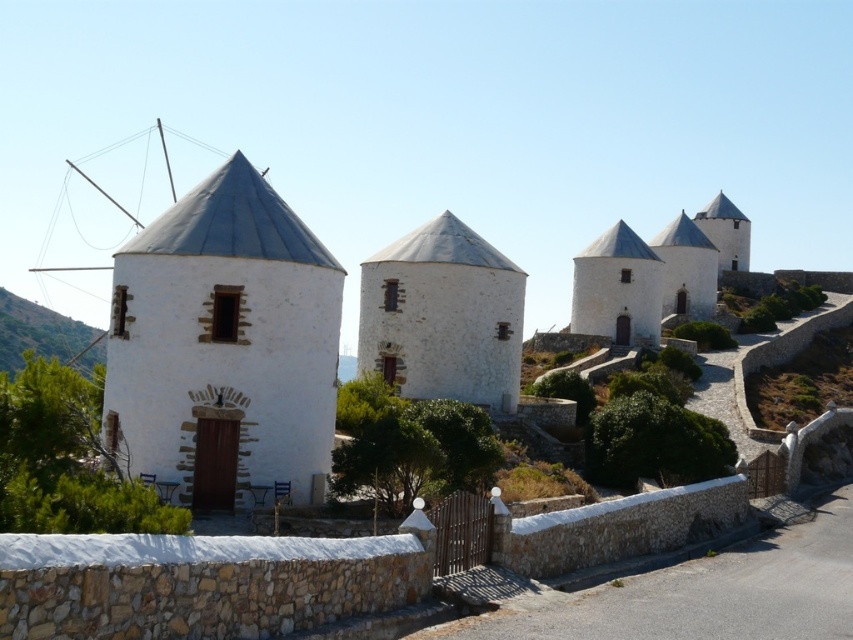
Question: In this image, where is white stone windmill at center located relative to white stone chapel at upper right?

Choices:
 (A) above
 (B) below

Answer: (B)

Question: Estimate the real-world distances between objects in this image. Which object is farther from the white stone windmill at center?

Choices:
 (A) white stone chapel at upper right
 (B) green grass at left

Answer: (B)

Question: Is white stone windmill at left smaller than green grass at left?

Choices:
 (A) no
 (B) yes

Answer: (B)

Question: Which object is the closest to the white stone chapel at upper right?

Choices:
 (A) white stone windmill at center
 (B) white stone windmill at left

Answer: (A)

Question: Considering the real-world distances, which object is farthest from the white stone chapel at upper right?

Choices:
 (A) white stone windmill at left
 (B) green grass at left
 (C) white stone windmill at center

Answer: (B)

Question: Is the position of white stone windmill at left less distant than that of green grass at left?

Choices:
 (A) no
 (B) yes

Answer: (B)